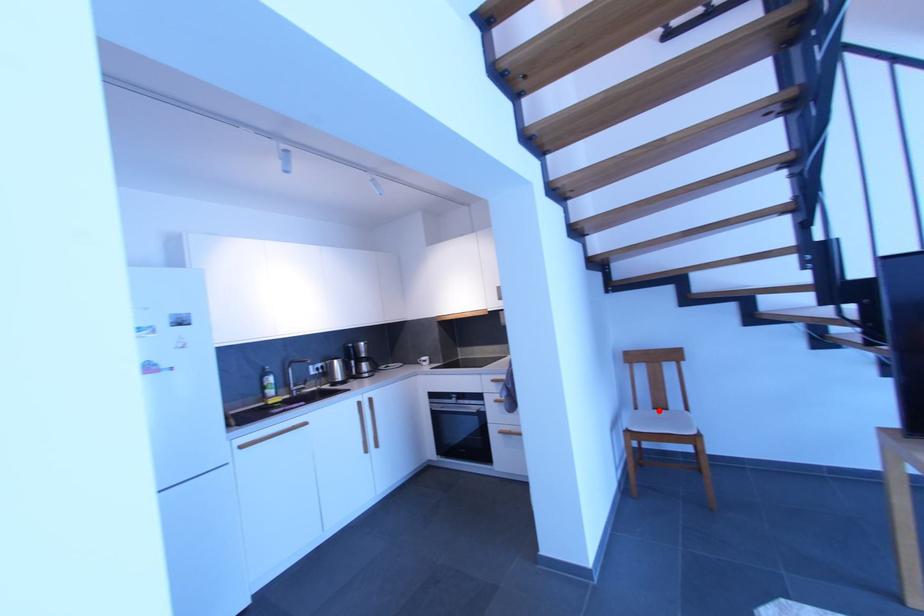
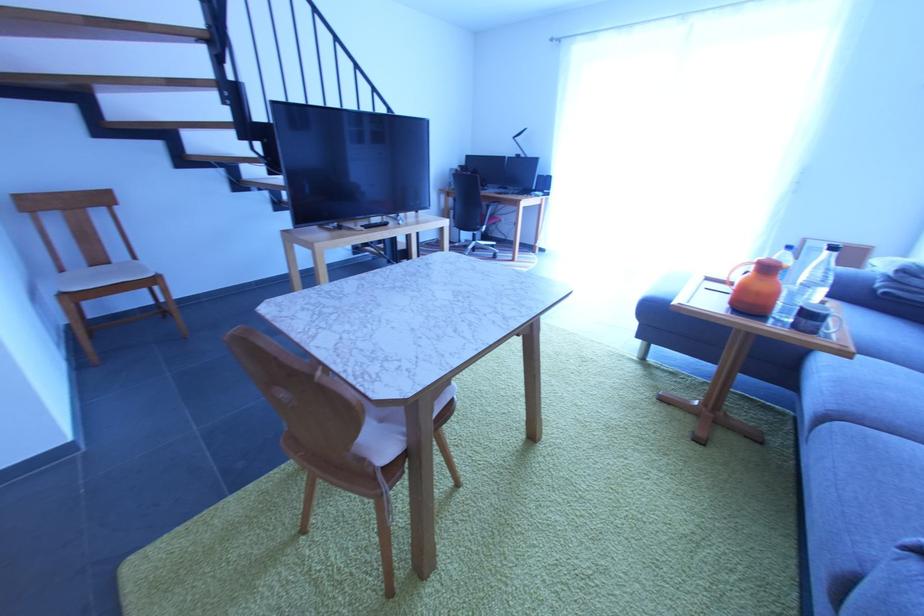
Find the pixel in the second image that matches the highlighted location in the first image.

(96, 268)